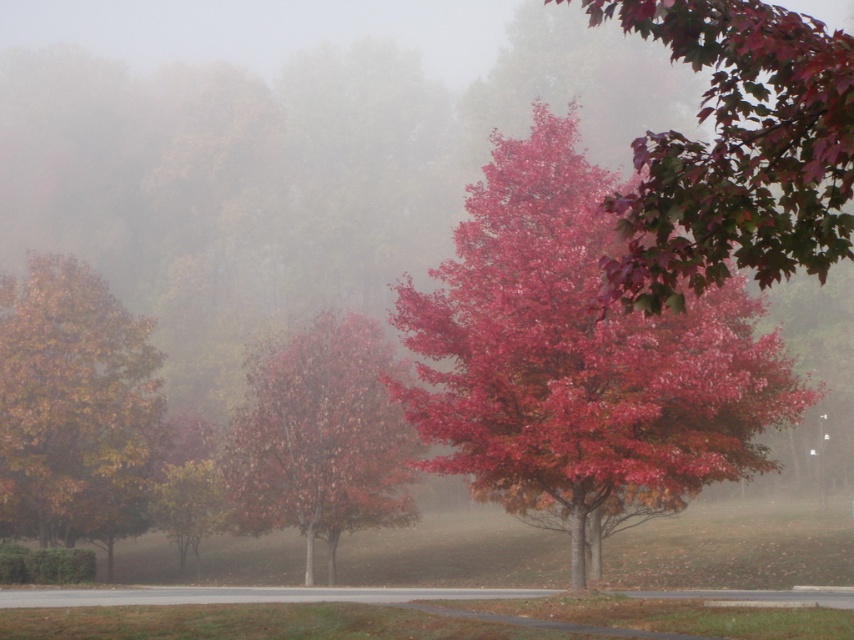
You are standing in the autumn scene and want to walk from your current position towards the point labeled as point (0, 477). There is an obstacle at point (466, 202). Will you encounter this obstacle before reaching your destination?

Yes, you will encounter the obstacle at point (466, 202) before reaching point (0, 477) because point (466, 202) is in front of point (0, 477).